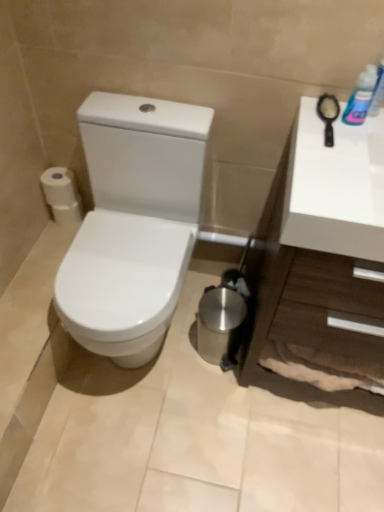
Question: Is blue plastic bottle at upper right inside white matte toilet paper at left?

Choices:
 (A) yes
 (B) no

Answer: (B)

Question: From the image's perspective, does white matte toilet paper at left appear lower than blue plastic bottle at upper right?

Choices:
 (A) yes
 (B) no

Answer: (A)

Question: From the image's perspective, does white matte toilet paper at left appear higher than blue plastic bottle at upper right?

Choices:
 (A) yes
 (B) no

Answer: (B)

Question: Is white matte toilet paper at left bigger than blue plastic bottle at upper right?

Choices:
 (A) yes
 (B) no

Answer: (A)

Question: Is white matte toilet paper at left not inside blue plastic bottle at upper right?

Choices:
 (A) yes
 (B) no

Answer: (A)

Question: Does point (x=61, y=172) appear closer or farther from the camera than point (x=360, y=104)?

Choices:
 (A) closer
 (B) farther

Answer: (B)

Question: Visually, is white matte toilet paper at left positioned to the left or to the right of blue plastic bottle at upper right?

Choices:
 (A) right
 (B) left

Answer: (B)

Question: Looking at the image, does white matte toilet paper at left seem bigger or smaller compared to blue plastic bottle at upper right?

Choices:
 (A) small
 (B) big

Answer: (B)

Question: In the image, is white matte toilet paper at left positioned in front of or behind blue plastic bottle at upper right?

Choices:
 (A) behind
 (B) front

Answer: (A)

Question: Based on their positions, is white glossy countertop at right located to the left or right of white matte toilet paper at left?

Choices:
 (A) right
 (B) left

Answer: (A)

Question: Is white glossy countertop at right bigger or smaller than white matte toilet paper at left?

Choices:
 (A) small
 (B) big

Answer: (B)

Question: From the image's perspective, relative to white matte toilet paper at left, is white glossy countertop at right above or below?

Choices:
 (A) below
 (B) above

Answer: (A)

Question: Does point (314, 205) appear closer or farther from the camera than point (66, 194)?

Choices:
 (A) closer
 (B) farther

Answer: (A)

Question: From a real-world perspective, is white glossy countertop at right positioned above or below blue plastic bottle at upper right?

Choices:
 (A) below
 (B) above

Answer: (A)

Question: Considering their positions, is white glossy countertop at right located in front of or behind blue plastic bottle at upper right?

Choices:
 (A) front
 (B) behind

Answer: (A)